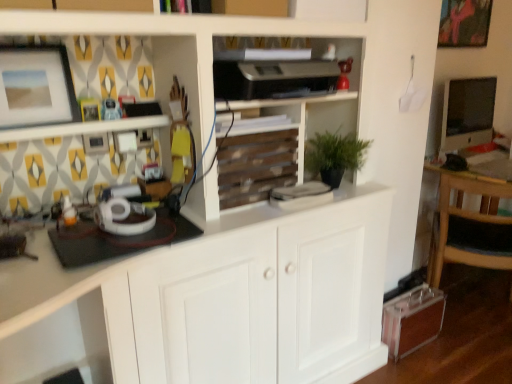
Where is `free space in front of wooden chair at right`? free space in front of wooden chair at right is located at coordinates (474, 356).